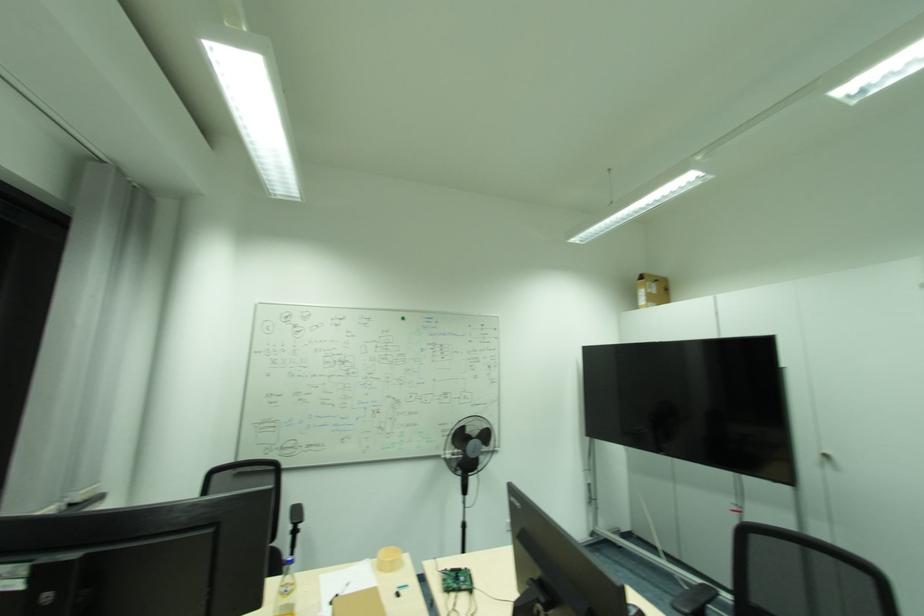
Identify the location of metal bottle cap. The image size is (924, 616). (388, 559).